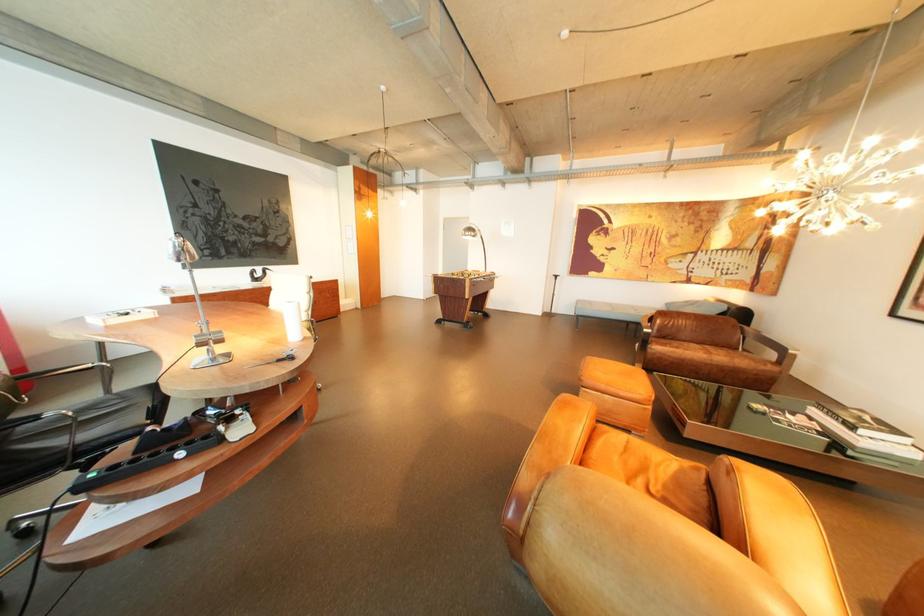
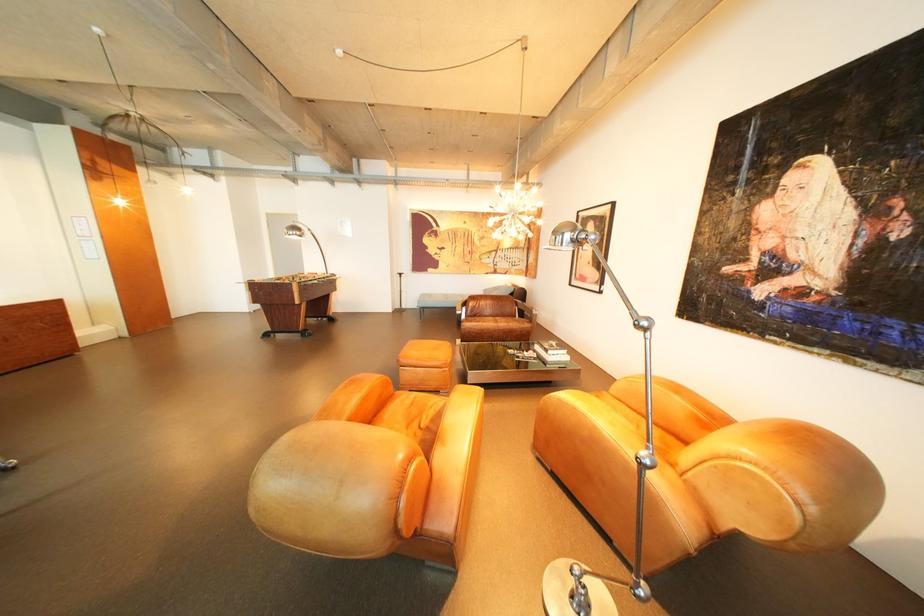
The point at [602,302] is marked in the first image. Where is the corresponding point in the second image?

(444, 296)